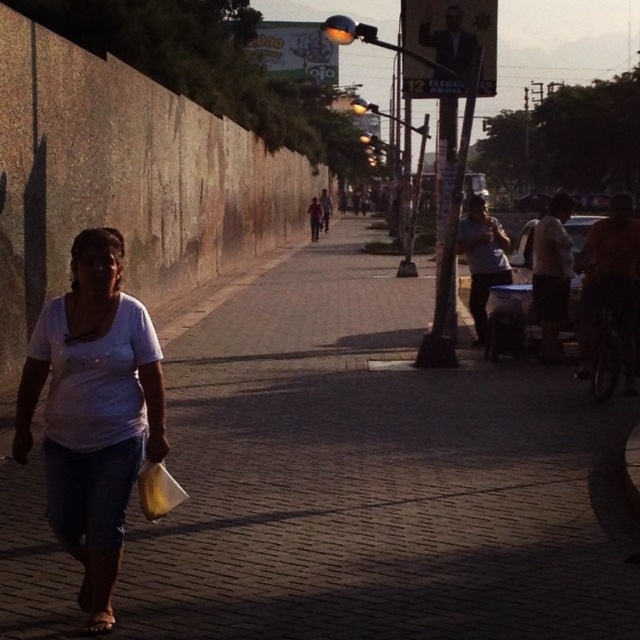
Question: Is brick pavement at center wider than white matte shirt at center?

Choices:
 (A) no
 (B) yes

Answer: (B)

Question: Is brick pavement at center wider than white matte shirt at center?

Choices:
 (A) yes
 (B) no

Answer: (A)

Question: Which point is closer to the camera taking this photo?

Choices:
 (A) (556, 486)
 (B) (104, 400)

Answer: (B)

Question: Which point is closer to the camera?

Choices:
 (A) brick pavement at center
 (B) white matte shirt at center

Answer: (B)

Question: Is brick pavement at center above white matte shirt at center?

Choices:
 (A) yes
 (B) no

Answer: (B)